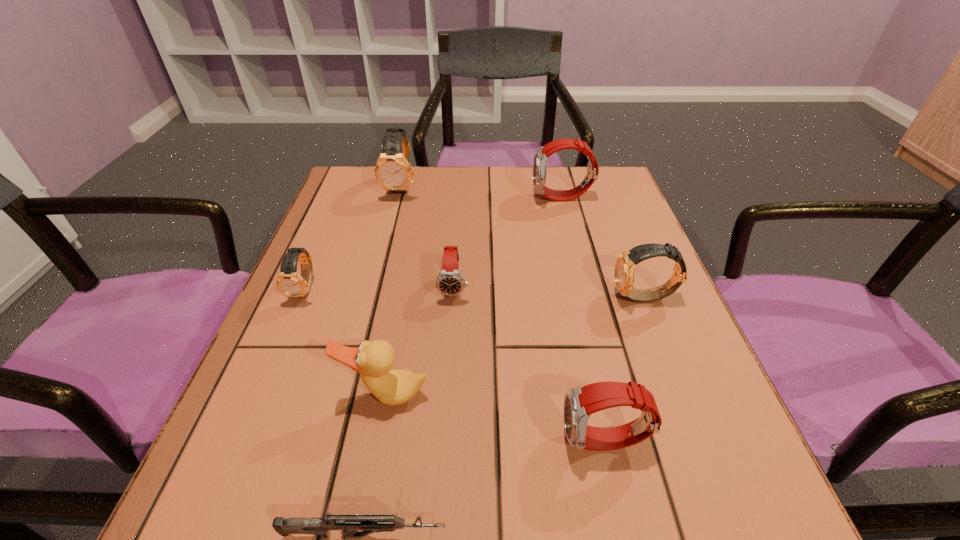
Where is `vacant space located on the face of the seventh farthest object`? The image size is (960, 540). vacant space located on the face of the seventh farthest object is located at coordinates (395, 442).

Locate an element on the screen. The width and height of the screenshot is (960, 540). vacant space located 0.290m on the face of the seventh farthest object is located at coordinates (360, 442).

Locate an element on the screen. The image size is (960, 540). blank space located on the beak of the tan duck is located at coordinates (361, 526).

Where is `vacant space located on the face of the leftmost watch`? The height and width of the screenshot is (540, 960). vacant space located on the face of the leftmost watch is located at coordinates (282, 342).

Where is `free spot located 0.200m on the face of the smallest red watch`? The image size is (960, 540). free spot located 0.200m on the face of the smallest red watch is located at coordinates (446, 395).

Locate an element on the screen. duck present at the left edge is located at coordinates (374, 360).

The image size is (960, 540). What are the coordinates of `object located at the far left corner` in the screenshot? It's located at (393, 171).

Where is `object at the far right corner`? object at the far right corner is located at coordinates (540, 158).

Find the location of a particular element. Image resolution: width=960 pixels, height=540 pixels. vacant space at the far edge of the desktop is located at coordinates (546, 172).

Locate an element on the screen. The width and height of the screenshot is (960, 540). blank area at the near edge is located at coordinates click(x=431, y=514).